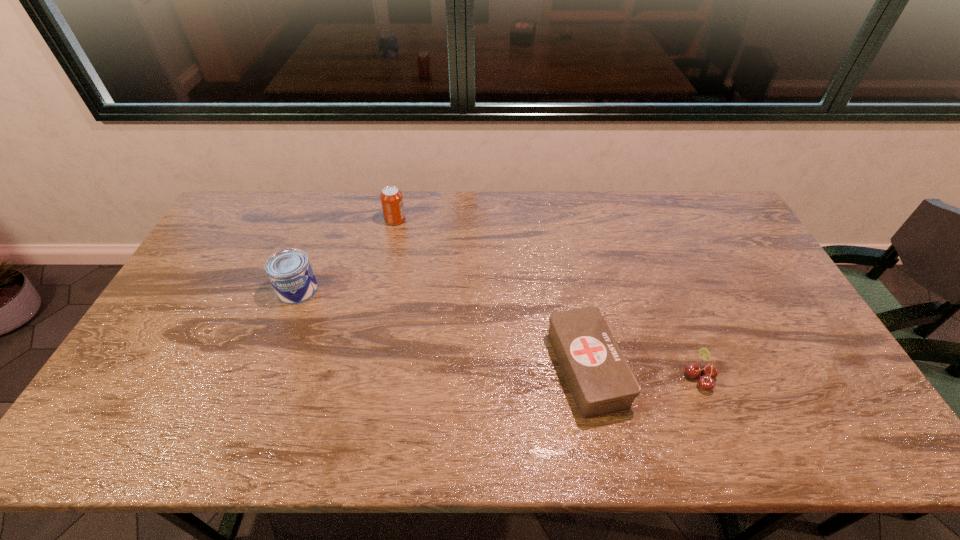
You are a GUI agent. You are given a task and a screenshot of the screen. Output one action in this format:
    pyautogui.click(x=<x>, y=<y>)
    Task: Click on the free location that satisfies the following two spatial constraints: 1. on the front label of the left can; 2. on the left side of the first-aid kit
    This screenshot has height=540, width=960.
    Given the screenshot: What is the action you would take?
    pyautogui.click(x=268, y=369)

Identify the location of free space in the image that satisfies the following two spatial constraints: 1. on the front label of the left can; 2. on the right side of the first-aid kit. The height and width of the screenshot is (540, 960). (268, 369).